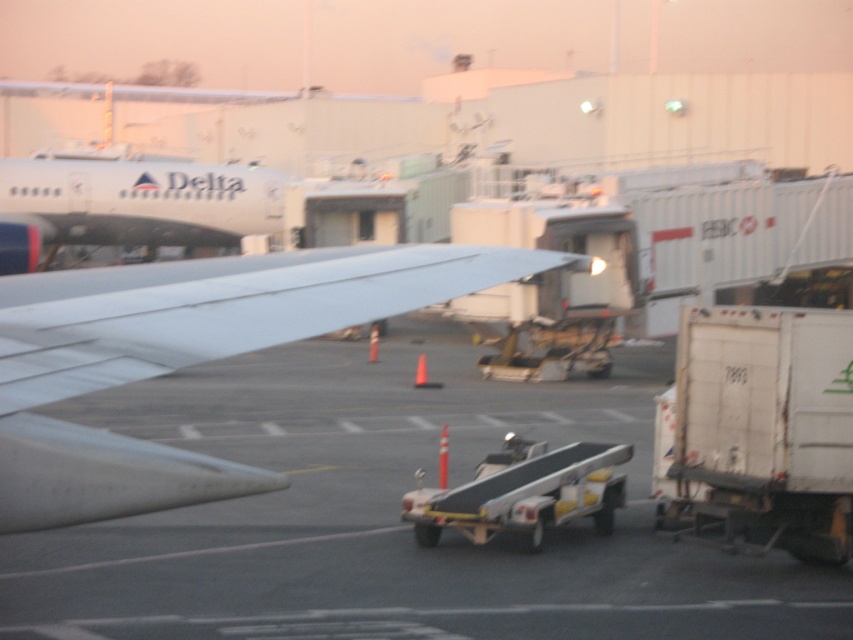
You are standing at the camera position and want to load luggage onto the white matte truck at right. The luggage is currently on the black conveyor belt in the midground. Can you directly walk from the conveyor belt to the truck without crossing any restricted areas marked by orange traffic cones?

The white matte truck at right is 10.02 meters from camera, so yes, you can walk from the conveyor belt to the truck as there is no mention of restricted areas between them in the scene description.

You are a ground crew member checking the layout of the airport. You need to determine if there is enough space between the silver metallic wing at center and the matte white airplane at upper left to move a 2.5 meter wide equipment cart. Can you confirm if the space is sufficient?

The silver metallic wing at center occupies less space than the matte white airplane at upper left. However, the exact dimensions of the space between them are not provided, so it is uncertain if the 2.5 meter wide equipment cart can fit. Further measurements are needed.

You are a pilot who needs to park your airplane on the tarmac. Based on the scene, which object occupies more space, the smooth asphalt tarmac at center or the matte white airplane at upper left?

The smooth asphalt tarmac at center is larger in size than the matte white airplane at upper left, so the smooth asphalt tarmac at center occupies more space.